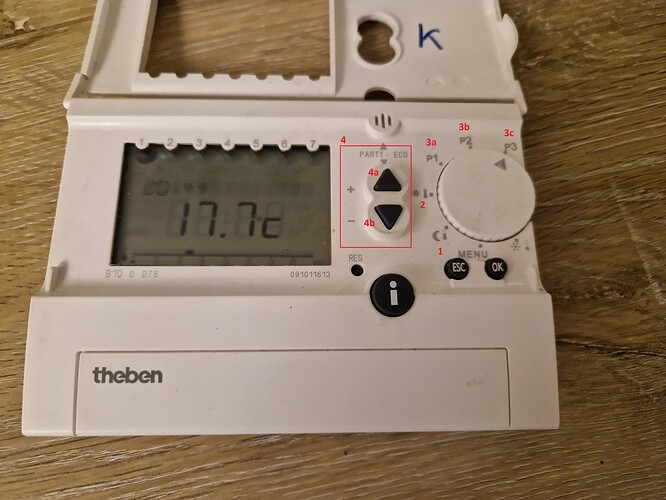
Locate an element on the screen. The width and height of the screenshot is (666, 500). temperature adjustment buttons "up" and "down" is located at coordinates click(x=390, y=179), click(x=388, y=212).